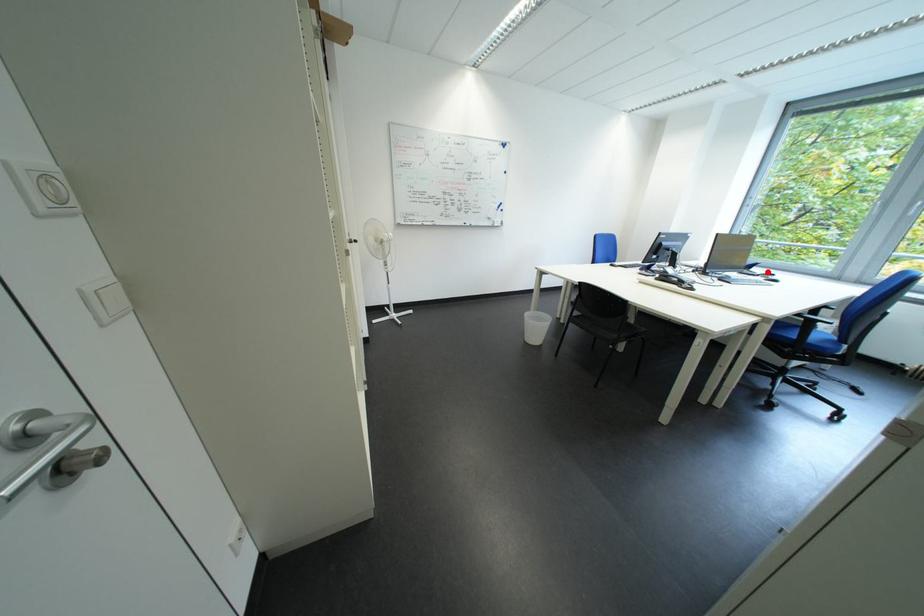
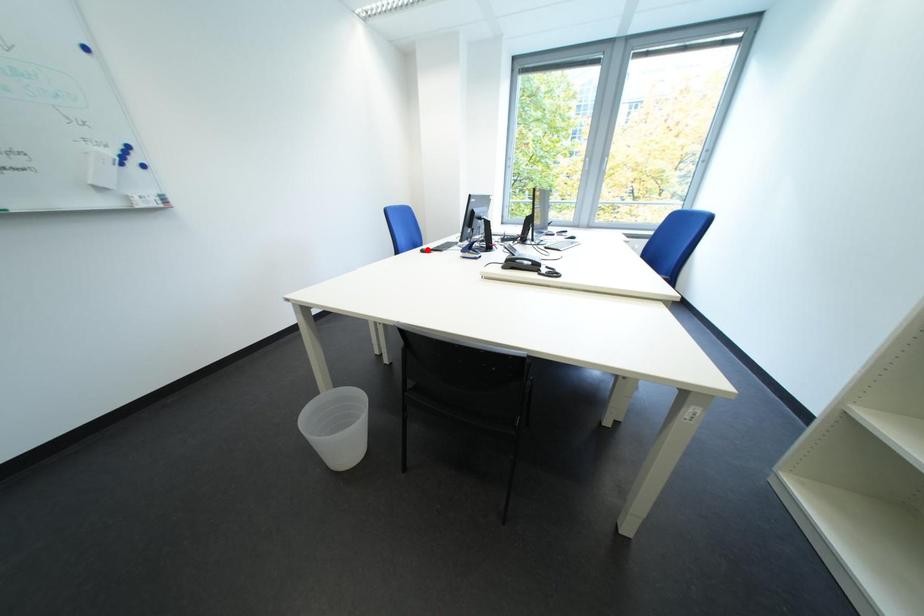
I am providing you with two images of the same scene from different viewpoints. A red point is marked on the first image and another point is marked on the second image. Is the red point in image1 aligned with the point shown in image2?

No